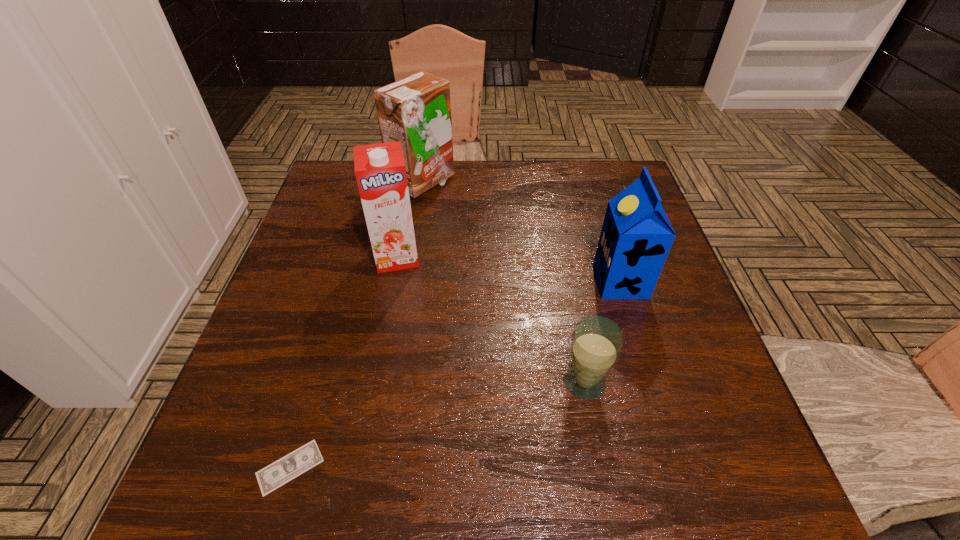
The height and width of the screenshot is (540, 960). In order to click on blank space located 0.210m on the back of the fourth farthest object in this screenshot , I will do `click(566, 285)`.

Image resolution: width=960 pixels, height=540 pixels. Find the location of `free region located 0.110m on the back of the shortest object`. free region located 0.110m on the back of the shortest object is located at coordinates (315, 383).

This screenshot has height=540, width=960. Find the location of `object that is at the far edge`. object that is at the far edge is located at coordinates (416, 110).

Identify the location of object that is at the near edge. (275, 475).

Locate an element on the screen. object situated at the left edge is located at coordinates pos(275,475).

This screenshot has height=540, width=960. Identify the location of object situated at the right edge. (636, 237).

Identify the location of object that is at the near left corner. This screenshot has width=960, height=540. (275, 475).

Locate an element on the screen. free space at the far edge of the desktop is located at coordinates (483, 162).

In order to click on free spot at the near edge of the desktop in this screenshot , I will do `click(607, 475)`.

This screenshot has height=540, width=960. Find the location of `free space at the left edge of the desktop`. free space at the left edge of the desktop is located at coordinates (324, 240).